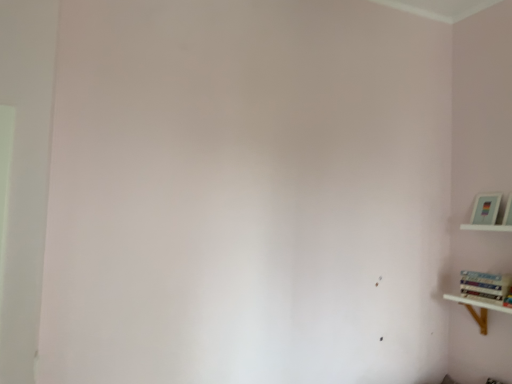
Question: Considering the relative sizes of white wooden shelf at lower right, which is the 2th shelf from top to bottom, and white wooden shelf at upper right, the first shelf from the top, in the image provided, is white wooden shelf at lower right, which is the 2th shelf from top to bottom, taller than white wooden shelf at upper right, the first shelf from the top,?

Choices:
 (A) yes
 (B) no

Answer: (A)

Question: Are white wooden shelf at lower right, which is the 2th shelf from top to bottom, and white wooden shelf at upper right, the first shelf from the top, located far from each other?

Choices:
 (A) yes
 (B) no

Answer: (B)

Question: Is the surface of white wooden shelf at lower right, the 1th shelf in the bottom-to-top sequence, in direct contact with white wooden shelf at upper right, the first shelf from the top?

Choices:
 (A) yes
 (B) no

Answer: (B)

Question: Is white wooden shelf at lower right, the 1th shelf in the bottom-to-top sequence, positioned before white wooden shelf at upper right, the first shelf from the top?

Choices:
 (A) yes
 (B) no

Answer: (A)

Question: Can you confirm if white wooden shelf at lower right, the 1th shelf in the bottom-to-top sequence, is positioned to the right of white wooden shelf at upper right, the 2th shelf when ordered from bottom to top?

Choices:
 (A) yes
 (B) no

Answer: (B)

Question: Can you confirm if white wooden shelf at lower right, the 1th shelf in the bottom-to-top sequence, is thinner than white wooden shelf at upper right, the first shelf from the top?

Choices:
 (A) no
 (B) yes

Answer: (A)

Question: Is hardcover book at right surrounded by white wooden shelf at lower right, the 1th shelf in the bottom-to-top sequence?

Choices:
 (A) yes
 (B) no

Answer: (B)

Question: Does white wooden shelf at lower right, which is the 2th shelf from top to bottom, have a greater height compared to hardcover book at right?

Choices:
 (A) yes
 (B) no

Answer: (A)

Question: Is white wooden shelf at lower right, the 1th shelf in the bottom-to-top sequence, positioned with its back to hardcover book at right?

Choices:
 (A) no
 (B) yes

Answer: (A)

Question: From a real-world perspective, is white wooden shelf at lower right, the 1th shelf in the bottom-to-top sequence, located beneath hardcover book at right?

Choices:
 (A) yes
 (B) no

Answer: (A)

Question: Does white wooden shelf at lower right, the 1th shelf in the bottom-to-top sequence, have a lesser width compared to hardcover book at right?

Choices:
 (A) no
 (B) yes

Answer: (A)

Question: Does white wooden shelf at lower right, the 1th shelf in the bottom-to-top sequence, lie in front of hardcover book at right?

Choices:
 (A) yes
 (B) no

Answer: (A)

Question: Is white wooden shelf at upper right, the first shelf from the top, facing away from hardcover book at right?

Choices:
 (A) yes
 (B) no

Answer: (B)